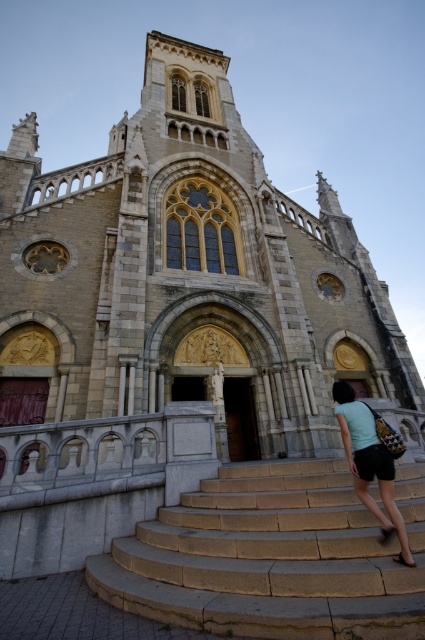
Question: Is stone stairs at center to the left of light blue fabric at center from the viewer's perspective?

Choices:
 (A) yes
 (B) no

Answer: (A)

Question: Among these points, which one is farthest from the camera?

Choices:
 (A) (367, 550)
 (B) (370, 467)

Answer: (B)

Question: Among these points, which one is nearest to the camera?

Choices:
 (A) (359, 477)
 (B) (314, 589)

Answer: (B)

Question: Is stone stairs at center behind light blue fabric at center?

Choices:
 (A) yes
 (B) no

Answer: (B)

Question: Is stone stairs at center thinner than light blue fabric at center?

Choices:
 (A) yes
 (B) no

Answer: (B)

Question: Which of the following is the closest to the observer?

Choices:
 (A) stone stairs at center
 (B) light blue fabric at center

Answer: (A)